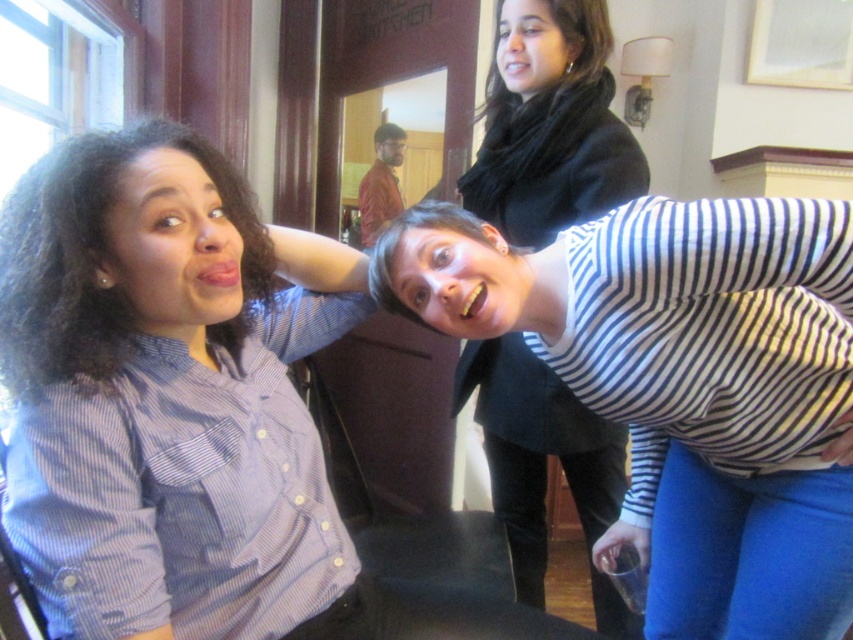
Is white striped shirt at lower right shorter than red shirt at center?

In fact, white striped shirt at lower right may be taller than red shirt at center.

Which is behind, point (735, 628) or point (376, 218)?

Point (376, 218)

In order to click on white striped shirt at lower right in this screenshot , I will do `click(683, 385)`.

Which is above, white striped shirt at lower right or black silky scarf at upper center?

black silky scarf at upper center

Which is in front, point (810, 477) or point (561, 16)?

Point (810, 477)

Is point (650, 264) positioned before point (572, 8)?

That is True.

Locate an element on the screen. The height and width of the screenshot is (640, 853). white striped shirt at lower right is located at coordinates (683, 385).

Does blue striped shirt at upper center have a lesser width compared to black silky scarf at upper center?

No, blue striped shirt at upper center is not thinner than black silky scarf at upper center.

Can you confirm if blue striped shirt at upper center is taller than black silky scarf at upper center?

Correct, blue striped shirt at upper center is much taller as black silky scarf at upper center.

Describe the element at coordinates (183, 406) in the screenshot. The width and height of the screenshot is (853, 640). I see `blue striped shirt at upper center` at that location.

This screenshot has width=853, height=640. What are the coordinates of `blue striped shirt at upper center` in the screenshot? It's located at (183, 406).